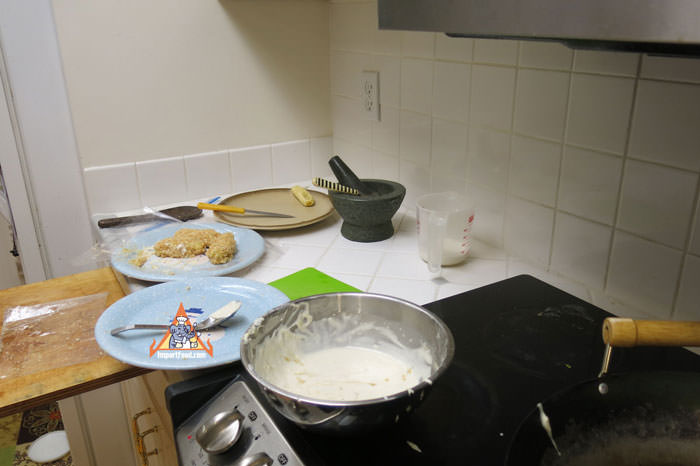
Locate an element on the screen. The image size is (700, 466). outlet is located at coordinates (376, 101).